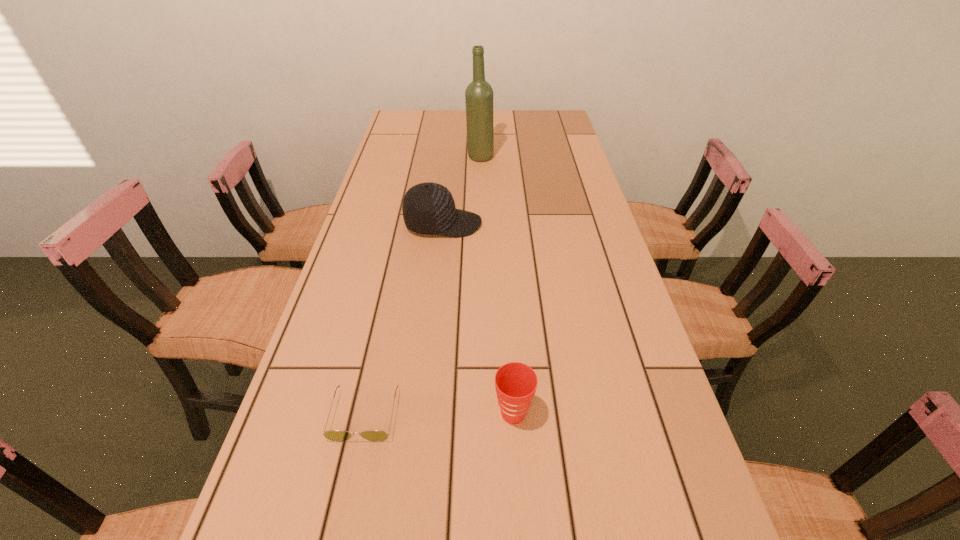
Where is `free space between the sunglasses and the farthest object`? The width and height of the screenshot is (960, 540). free space between the sunglasses and the farthest object is located at coordinates pyautogui.click(x=422, y=286).

The width and height of the screenshot is (960, 540). I want to click on vacant space in between the third nearest object and the cup, so click(x=478, y=319).

You are a GUI agent. You are given a task and a screenshot of the screen. Output one action in this format:
    pyautogui.click(x=<x>, y=<y>)
    Task: Click on the free spot between the third tallest object and the sunglasses
    This screenshot has height=540, width=960.
    Given the screenshot: What is the action you would take?
    pyautogui.click(x=439, y=414)

Image resolution: width=960 pixels, height=540 pixels. Find the location of `free space between the tallest object and the shortest object`. free space between the tallest object and the shortest object is located at coordinates (422, 286).

The width and height of the screenshot is (960, 540). I want to click on vacant space in between the baseball cap and the third tallest object, so click(478, 319).

Where is `blank region between the wine bottle and the third nearest object`? Image resolution: width=960 pixels, height=540 pixels. blank region between the wine bottle and the third nearest object is located at coordinates (462, 191).

Identify the location of object that is the closest to the second farthest object. The width and height of the screenshot is (960, 540). (479, 94).

Identify which object is the second closest to the cup. Please provide its 2D coordinates. Your answer should be formatted as a tuple, i.e. [(x, y)], where the tuple contains the x and y coordinates of a point satisfying the conditions above.

[(428, 208)]

Identify the location of vacant point that satisfies the following two spatial constraints: 1. at the front of the third tallest object where the brim is located; 2. on the right side of the second farthest object. (422, 414).

In order to click on vacant space that satisfies the following two spatial constraints: 1. at the front of the second farthest object where the brim is located; 2. on the front-facing side of the sunglasses in this screenshot , I will do `click(422, 414)`.